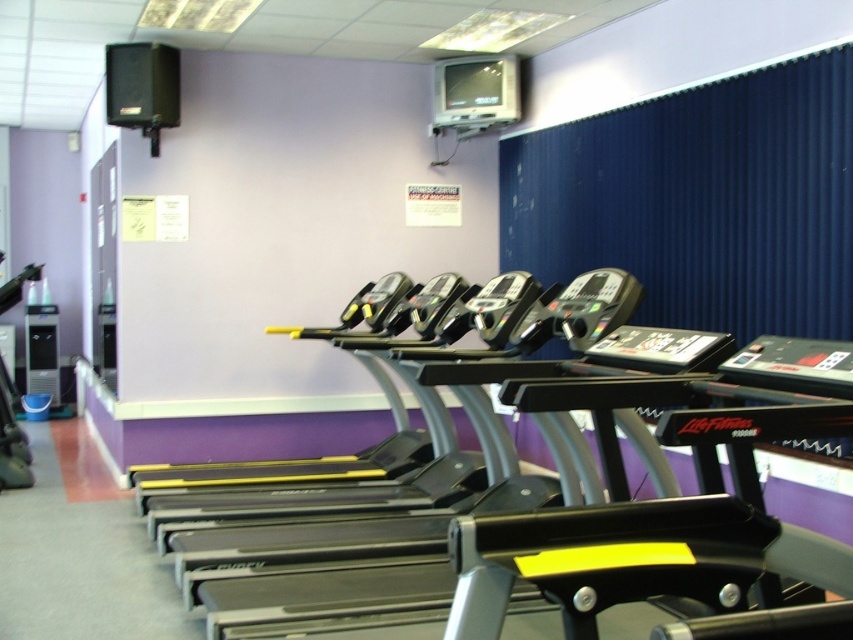
You are standing at the entrance of the gym and see the point marked at coordinates [537,481]. What object is located at that point?

The point at coordinates [537,481] marks the location of the black plastic treadmills at center.

You are a gym member who wants to adjust the TV above the treadmills but needs to ensure there is enough space between the black plastic treadmills at center and the blue fabric curtain at upper right to safely move a ladder. The ladder is 6 feet tall. Can you fit the ladder between them?

The black plastic treadmills at center and blue fabric curtain at upper right are 6.40 feet apart from each other. Since the ladder is 6 feet tall, it can be placed between them as the distance is sufficient.

You are standing at point A with coordinates point(459, 552). You want to walk to point B, which is 7.11 feet away from you. Is there enough space between the treadmills to walk through?

The treadmills are aligned in a neat row against the purple wall, but the distance between point A and point B is 7.11 feet. Since the treadmills are placed in an orderly fashion, there should be sufficient space between them to walk through the 7.11 feet distance.